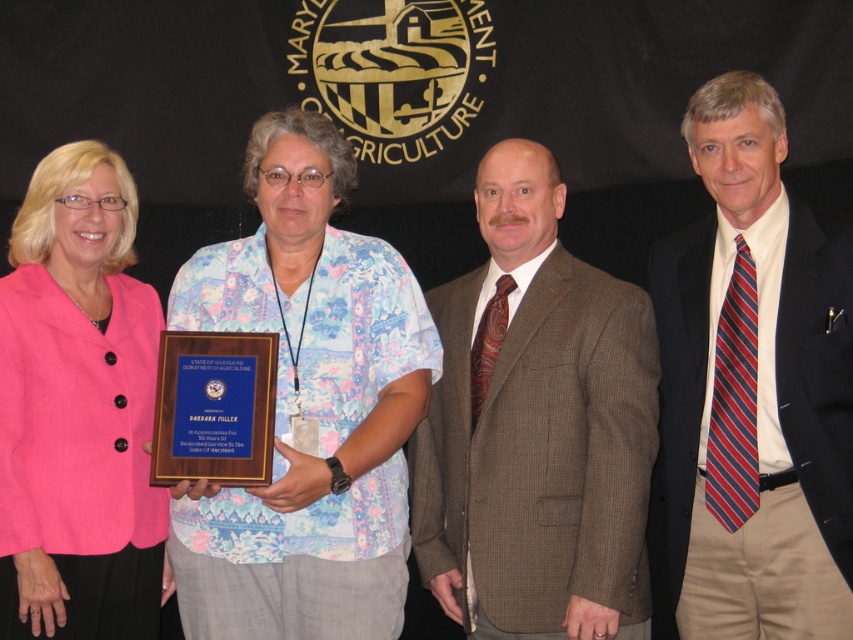
You are organizing a photo shoot and need to ensure that the brown textured suit at center and the floral fabric shirt at center fit within a 2.5 meter wide backdrop. Given their widths, will both items fit side by side?

The brown textured suit at center is narrower than the floral fabric shirt at center. However, without knowing the exact widths of both items, it is impossible to determine if their combined width exceeds 2.5 meters. Additional measurements are needed.